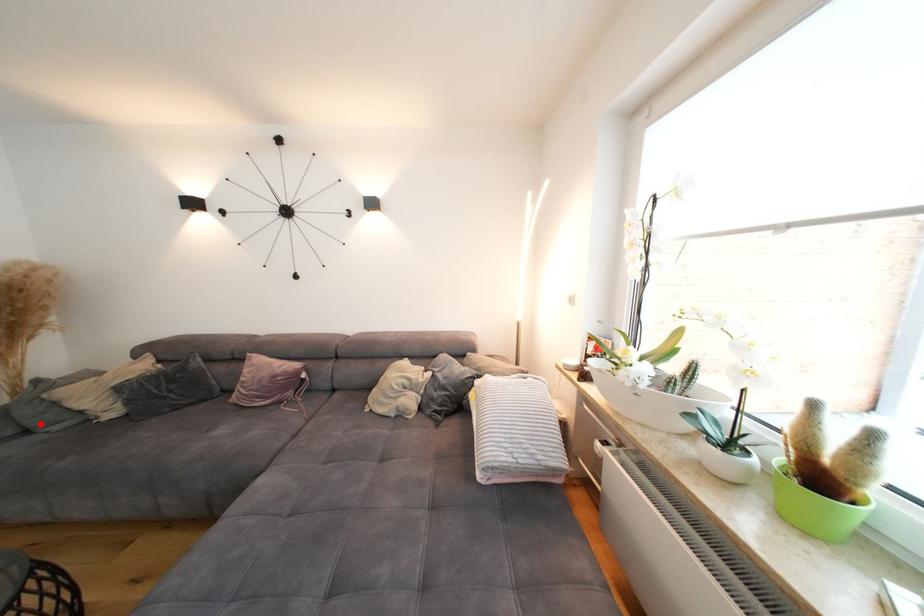
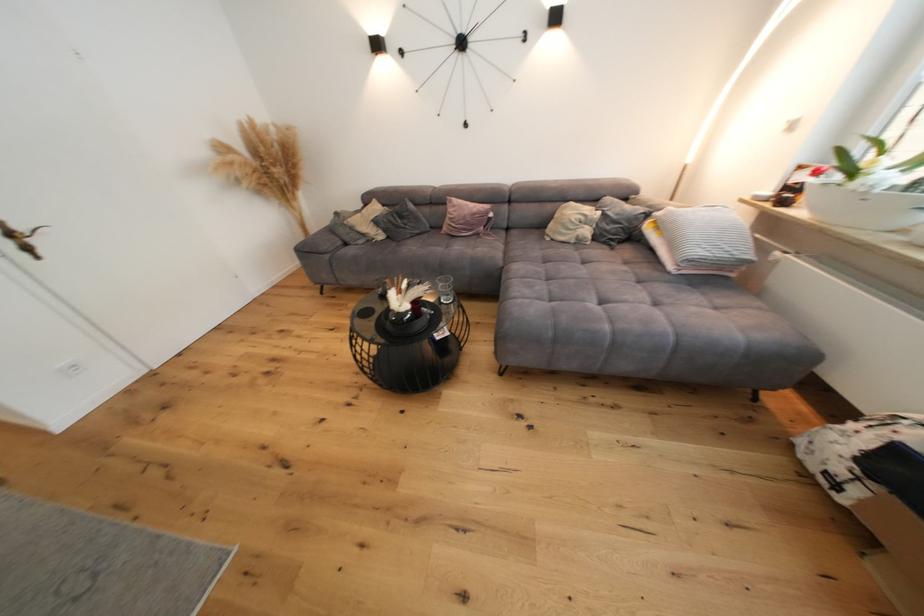
Question: I am providing you with two images of the same scene from different viewpoints. Given a red point in image1, look at the same physical point in image2. Is it:

Choices:
 (A) Closer to the viewpoint
 (B) Farther from the viewpoint

Answer: (B)